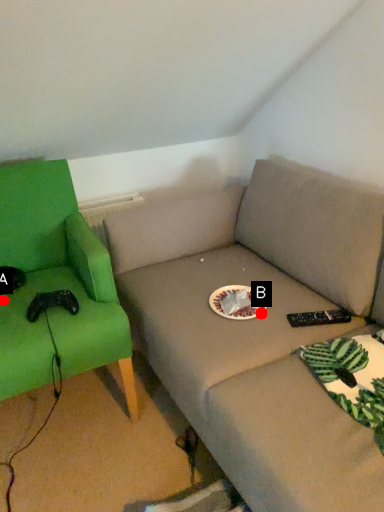
Question: Two points are circled on the image, labeled by A and B beside each circle. Which point appears farthest from the camera in this image?

Choices:
 (A) A is further
 (B) B is further

Answer: (A)